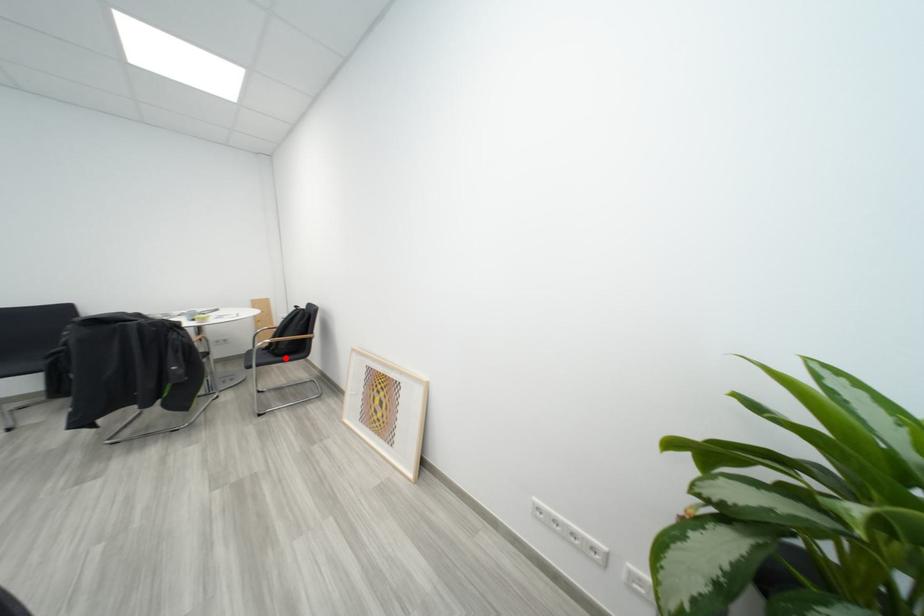
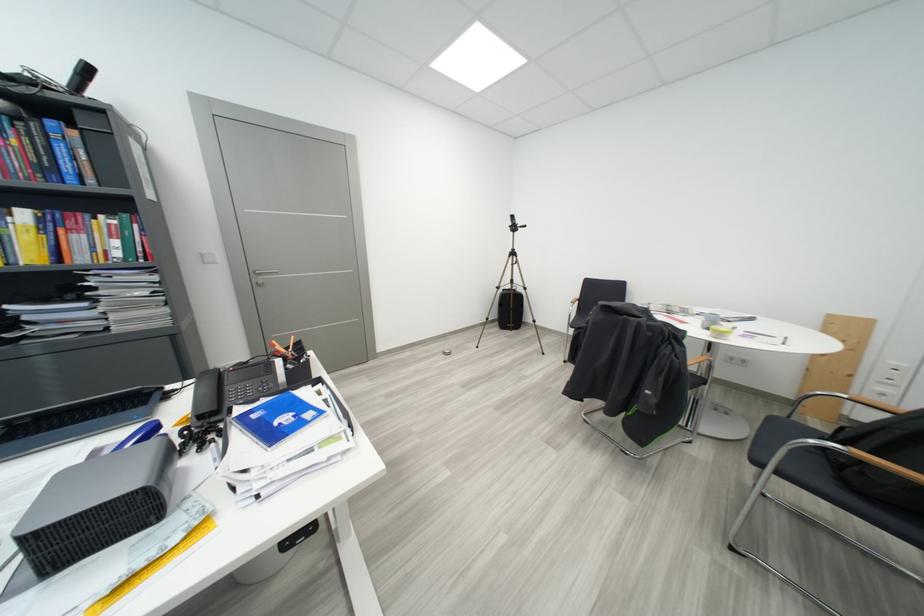
In the second image, find the point that corresponds to the highlighted location in the first image.

(856, 487)